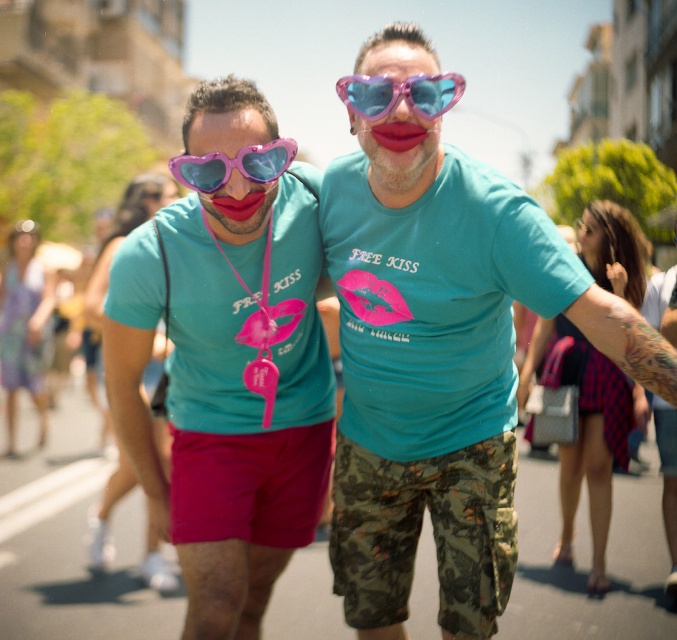
Looking at this image, you are a photographer trying to capture the matte pink sunglasses at center in your shot. Given that your camera has a focus point at coordinates 0.561, 0.340, will the sunglasses be in focus?

Yes, the matte pink sunglasses at center is located at point (230, 358), so the camera focus point will directly align with it, ensuring the sunglasses are in focus.